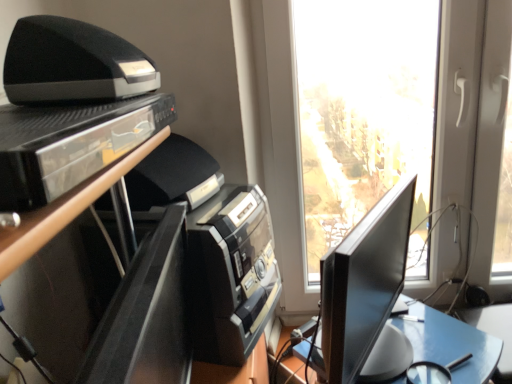
Question: Does point (366, 284) appear closer or farther from the camera than point (119, 72)?

Choices:
 (A) farther
 (B) closer

Answer: (A)

Question: In terms of width, does black glossy monitor at right look wider or thinner when compared to black plastic printer at upper left?

Choices:
 (A) thin
 (B) wide

Answer: (B)

Question: Considering the real-world distances, which object is farthest from the black plastic printer at upper left?

Choices:
 (A) black glossy entertainment center at left
 (B) black glossy shelf at upper left
 (C) black glossy monitor at right

Answer: (C)

Question: Which object is positioned closest to the black glossy shelf at upper left?

Choices:
 (A) black glossy monitor at right
 (B) black glossy entertainment center at left
 (C) black plastic printer at upper left

Answer: (C)